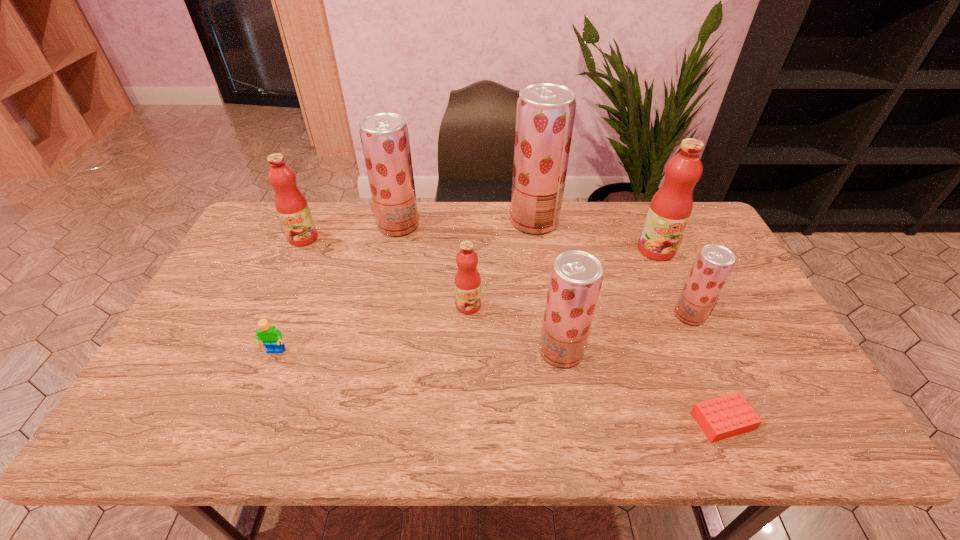
At what (x,y) coordinates should I click in order to perform the action: click on object located at the far right corner. Please return your answer as a coordinate pair (x, y). Image resolution: width=960 pixels, height=540 pixels. Looking at the image, I should click on (670, 208).

In the image, there is a desktop. At what (x,y) coordinates should I click in order to perform the action: click on free space at the far edge. Please return your answer as a coordinate pair (x, y). Looking at the image, I should click on (562, 241).

This screenshot has height=540, width=960. I want to click on vacant space at the near edge of the desktop, so 303,415.

Image resolution: width=960 pixels, height=540 pixels. I want to click on free region at the left edge of the desktop, so click(x=228, y=294).

The height and width of the screenshot is (540, 960). In the image, there is a desktop. What are the coordinates of `vacant space at the near left corner` in the screenshot? It's located at (193, 410).

The height and width of the screenshot is (540, 960). Find the location of `vacant area between the farther Lego and the leftmost fruit juice`. vacant area between the farther Lego and the leftmost fruit juice is located at coordinates (290, 295).

Find the location of a particular element. The image size is (960, 540). unoccupied area between the fourth object from left to right and the farther Lego is located at coordinates (372, 328).

At what (x,y) coordinates should I click in order to perform the action: click on free spot between the smallest strawberry fruit juice and the leftmost pink fruit juice. Please return your answer as a coordinate pair (x, y). Looking at the image, I should click on (496, 276).

Identify the location of empty space between the nearest fruit juice and the right Lego. The image size is (960, 540). pyautogui.click(x=641, y=386).

At what (x,y) coordinates should I click in order to perform the action: click on empty space between the shorter Lego and the rightmost pink fruit juice. Please return your answer as a coordinate pair (x, y). Image resolution: width=960 pixels, height=540 pixels. Looking at the image, I should click on (689, 335).